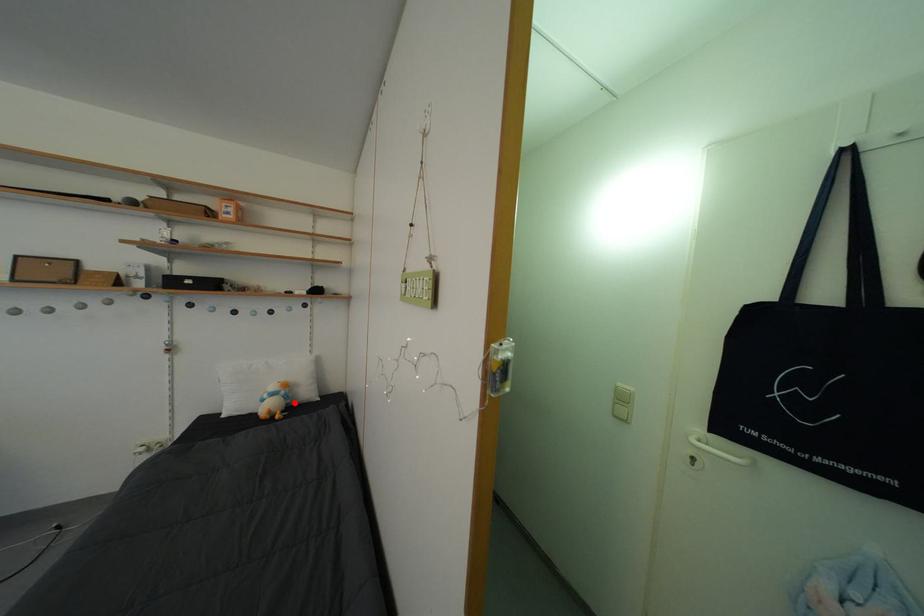
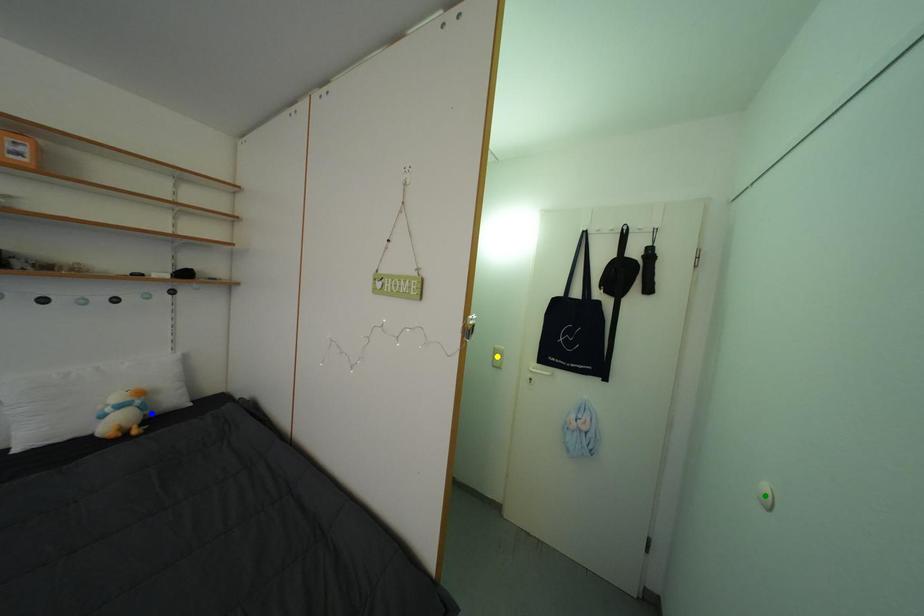
Question: I am providing you with two images of the same scene from different viewpoints. A red point is marked on the first image. You are given multiple points on the second image. Which spot in image 2 lines up with the point in image 1?

Choices:
 (A) green point
 (B) blue point
 (C) yellow point

Answer: (B)